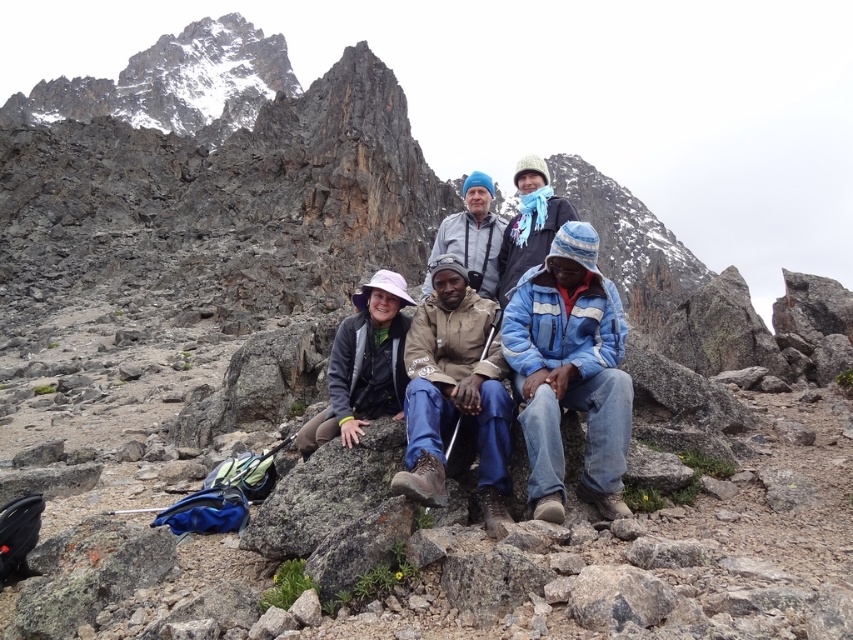
Is point (531, 186) closer to camera compared to point (479, 198)?

Yes, point (531, 186) is closer to viewer.

Looking at this image, is blue knitted hat at upper center positioned at the back of blue knit cap at center?

That is False.

What do you see at coordinates (529, 224) in the screenshot?
I see `blue knitted hat at upper center` at bounding box center [529, 224].

You are a GUI agent. You are given a task and a screenshot of the screen. Output one action in this format:
    pyautogui.click(x=<x>, y=<y>)
    Task: Click on the blue knitted hat at upper center
    
    Given the screenshot: What is the action you would take?
    pyautogui.click(x=529, y=224)

Locate an element on the screen. pink fabric hat at lower left is located at coordinates (363, 364).

Between pink fabric hat at lower left and blue knitted hat at upper center, which one has less height?

pink fabric hat at lower left is shorter.

Measure the distance between pink fabric hat at lower left and camera.

pink fabric hat at lower left is 33.97 meters away from camera.

You are a GUI agent. You are given a task and a screenshot of the screen. Output one action in this format:
    pyautogui.click(x=<x>, y=<y>)
    Task: Click on the pink fabric hat at lower left
    
    Given the screenshot: What is the action you would take?
    pyautogui.click(x=363, y=364)

Which is in front, point (581, 280) or point (399, 394)?

Point (581, 280) is in front.

The width and height of the screenshot is (853, 640). I want to click on blue fleece jacket at center, so click(x=569, y=372).

Identify the location of blue fleece jacket at center. The image size is (853, 640). (569, 372).